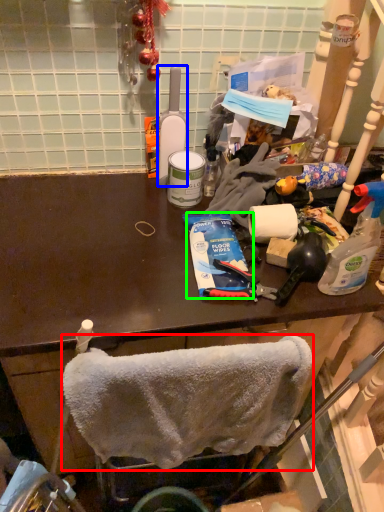
Question: Which is nearer to the towel/napkin (highlighted by a red box)? bottle (highlighted by a blue box) or toothpaste (highlighted by a green box).

Choices:
 (A) bottle
 (B) toothpaste

Answer: (B)